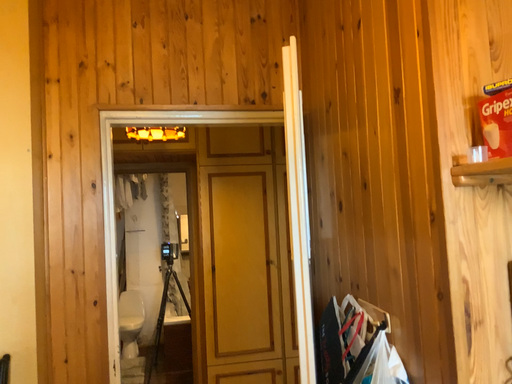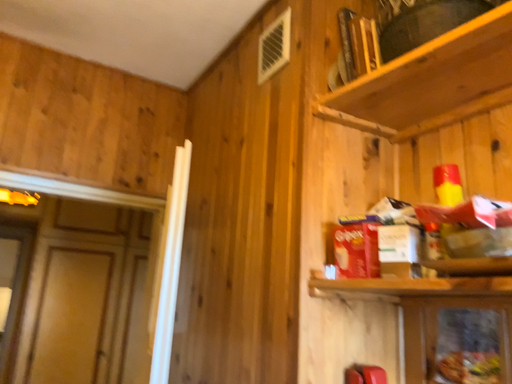
Question: How did the camera likely rotate when shooting the video?

Choices:
 (A) rotated upward
 (B) rotated downward

Answer: (A)